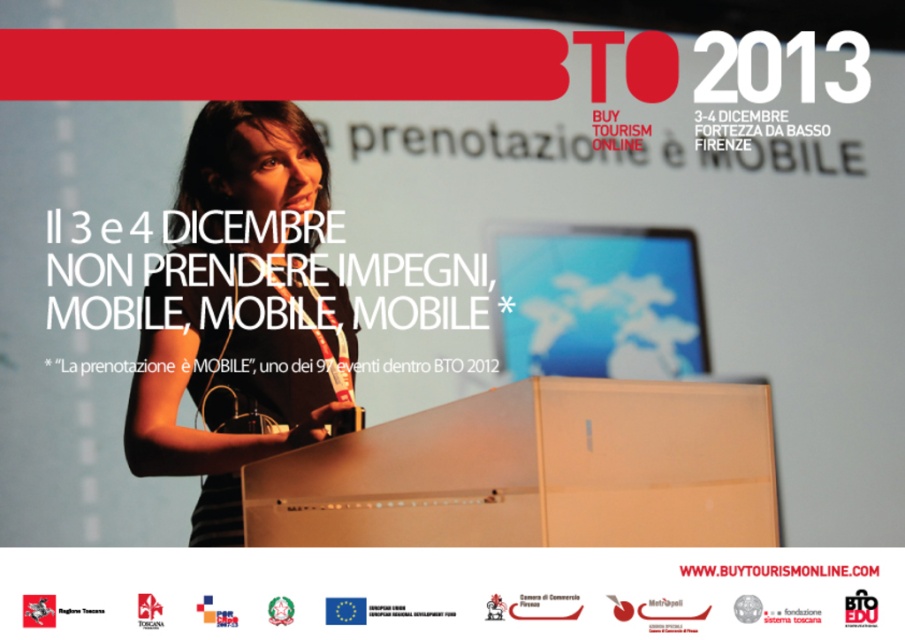
What is the 2D coordinate of the matte black laptop at upper center in the BTO 2013 promotional poster?

The 2D coordinate of the matte black laptop at upper center is at point (x=237, y=310).

You are designing a poster and need to place a new element at point (237, 310). According to the poster layout, what object is located at that point?

The point (237, 310) is on the matte black laptop at upper center.

You are designing a promotional poster for an event and need to place two items at the upper center. The matte black laptop at upper center and the white paper at upper center. Which one should be made larger to emphasize the laptop as the main focus?

The matte black laptop at upper center is already larger in size than the white paper at upper center, so it is the main focus.